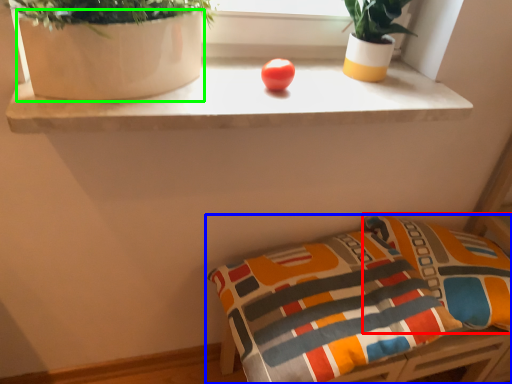
Question: Which object is positioned closest to pillow (highlighted by a red box)? Select from furniture (highlighted by a blue box) and vase (highlighted by a green box).

Choices:
 (A) furniture
 (B) vase

Answer: (A)